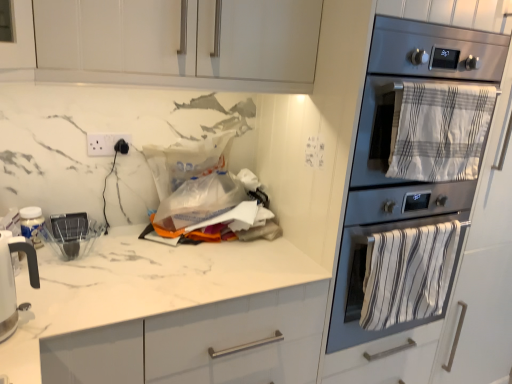
This screenshot has height=384, width=512. What do you see at coordinates (13, 280) in the screenshot?
I see `white glossy electric kettle at left` at bounding box center [13, 280].

Describe the element at coordinates (408, 274) in the screenshot. The image size is (512, 384). I see `white striped towel at right, placed as the first blanket when sorted from bottom to top` at that location.

Locate an element on the screen. white marble countertop at center is located at coordinates (169, 314).

Measure the distance from white striped towel at right, which appears as the second blanket when viewed from the top, to white glossy electric kettle at left.

The distance of white striped towel at right, which appears as the second blanket when viewed from the top, from white glossy electric kettle at left is 1.13 meters.

Consider the image. What's the angular difference between white striped towel at right, placed as the first blanket when sorted from bottom to top, and white glossy electric kettle at left's facing directions?

The angle between the facing direction of white striped towel at right, placed as the first blanket when sorted from bottom to top, and the facing direction of white glossy electric kettle at left is 43.8 degrees.

Is white striped towel at right, which appears as the second blanket when viewed from the top, looking in the opposite direction of white glossy electric kettle at left?

No, white glossy electric kettle at left is not at the back of white striped towel at right, which appears as the second blanket when viewed from the top.

Considering the relative positions of white striped towel at right, placed as the first blanket when sorted from bottom to top, and white glossy electric kettle at left in the image provided, is white striped towel at right, placed as the first blanket when sorted from bottom to top, to the left of white glossy electric kettle at left from the viewer's perspective?

In fact, white striped towel at right, placed as the first blanket when sorted from bottom to top, is to the right of white glossy electric kettle at left.

Does white glossy electric kettle at left turn towards white marble countertop at center?

No, white glossy electric kettle at left is not aimed at white marble countertop at center.

From the picture: Who is shorter, white glossy electric kettle at left or white marble countertop at center?

white glossy electric kettle at left is shorter.

From the picture: Considering the relative sizes of white glossy electric kettle at left and white marble countertop at center in the image provided, is white glossy electric kettle at left smaller than white marble countertop at center?

Yes.

Is white glossy electric kettle at left closer to the viewer compared to white marble countertop at center?

Yes.

Considering the positions of objects white plastic electric outlet at upper left and white glossy cabinet at upper center in the image provided, who is more to the left, white plastic electric outlet at upper left or white glossy cabinet at upper center?

white plastic electric outlet at upper left.

From a real-world perspective, is white plastic electric outlet at upper left located beneath white glossy cabinet at upper center?

Yes.

Does white plastic electric outlet at upper left have a greater height compared to white glossy cabinet at upper center?

In fact, white plastic electric outlet at upper left may be shorter than white glossy cabinet at upper center.

Can you tell me how much white plastic electric outlet at upper left and white glossy cabinet at upper center differ in facing direction?

0.342 degrees separate the facing orientations of white plastic electric outlet at upper left and white glossy cabinet at upper center.

Which object is positioned more to the left, white striped towel at right, which is the 2th blanket from bottom to top, or white glossy cabinet at upper center?

white glossy cabinet at upper center.

Is white striped towel at right, which is the first blanket from top to bottom, smaller than white glossy cabinet at upper center?

Yes.

Which is in front, point (435, 120) or point (23, 14)?

Positioned in front is point (23, 14).

From a real-world perspective, is white striped towel at right, placed as the first blanket when sorted from bottom to top, positioned above or below white striped towel at right, which is the first blanket from top to bottom?

In terms of real-world spatial position, white striped towel at right, placed as the first blanket when sorted from bottom to top, is below white striped towel at right, which is the first blanket from top to bottom.

How far apart are white striped towel at right, placed as the first blanket when sorted from bottom to top, and white striped towel at right, which is the 2th blanket from bottom to top?

The distance of white striped towel at right, placed as the first blanket when sorted from bottom to top, from white striped towel at right, which is the 2th blanket from bottom to top, is 13.84 inches.

Considering the points (387, 237) and (439, 106), which point is in front, point (387, 237) or point (439, 106)?

The point (439, 106) is closer.

Looking at this image, which is more to the left, white striped towel at right, placed as the first blanket when sorted from bottom to top, or white striped towel at right, which is the 2th blanket from bottom to top?

white striped towel at right, placed as the first blanket when sorted from bottom to top.

Which object is positioned more to the right, stainless steel oven at right or white striped towel at right, which is the 2th blanket from bottom to top?

white striped towel at right, which is the 2th blanket from bottom to top.

Considering the relative sizes of stainless steel oven at right and white striped towel at right, which is the first blanket from top to bottom, in the image provided, is stainless steel oven at right smaller than white striped towel at right, which is the first blanket from top to bottom,?

No, stainless steel oven at right is not smaller than white striped towel at right, which is the first blanket from top to bottom.

From the image's perspective, between stainless steel oven at right and white striped towel at right, which is the 2th blanket from bottom to top, which one is located above?

white striped towel at right, which is the 2th blanket from bottom to top.

Considering the sizes of objects stainless steel oven at right and white striped towel at right, which is the first blanket from top to bottom, in the image provided, who is shorter, stainless steel oven at right or white striped towel at right, which is the first blanket from top to bottom,?

Standing shorter between the two is white striped towel at right, which is the first blanket from top to bottom.

Is white striped towel at right, which appears as the second blanket when viewed from the top, completely or partially outside of white plastic electric outlet at upper left?

Yes, white striped towel at right, which appears as the second blanket when viewed from the top, is located beyond the bounds of white plastic electric outlet at upper left.

Based on their positions, is white striped towel at right, placed as the first blanket when sorted from bottom to top, located to the left or right of white plastic electric outlet at upper left?

Based on their positions, white striped towel at right, placed as the first blanket when sorted from bottom to top, is located to the right of white plastic electric outlet at upper left.

Measure the distance from white striped towel at right, placed as the first blanket when sorted from bottom to top, to white plastic electric outlet at upper left.

white striped towel at right, placed as the first blanket when sorted from bottom to top, and white plastic electric outlet at upper left are 3.61 feet apart.

Locate an element on the screen. The width and height of the screenshot is (512, 384). electric outlet that appears behind the white striped towel at right, which appears as the second blanket when viewed from the top is located at coordinates (104, 143).

What are the coordinates of `blanket that is below the white glossy electric kettle at left (from the image's perspective)` in the screenshot? It's located at (408, 274).

The height and width of the screenshot is (384, 512). In order to click on countertop on the right of white glossy electric kettle at left in this screenshot , I will do `click(169, 314)`.

Based on the photo, considering their positions, is white striped towel at right, which is the 2th blanket from bottom to top, positioned further to white glossy cabinet at upper center than white glossy electric kettle at left?

white glossy electric kettle at left.

Estimate the real-world distances between objects in this image. Which object is further from white glossy cabinet at upper center, stainless steel oven at right or white glossy electric kettle at left?

white glossy electric kettle at left lies further to white glossy cabinet at upper center than the other object.

Considering their positions, is white striped towel at right, placed as the first blanket when sorted from bottom to top, positioned closer to stainless steel oven at right than white marble countertop at center?

Among the two, white striped towel at right, placed as the first blanket when sorted from bottom to top, is located nearer to stainless steel oven at right.

When comparing their distances from white glossy cabinet at upper center, does white striped towel at right, which is the first blanket from top to bottom, or white marble countertop at center seem closer?

Among the two, white striped towel at right, which is the first blanket from top to bottom, is located nearer to white glossy cabinet at upper center.

Looking at the image, which one is located closer to white glossy electric kettle at left, white plastic electric outlet at upper left or white striped towel at right, which is the 2th blanket from bottom to top?

The object closer to white glossy electric kettle at left is white plastic electric outlet at upper left.

Considering their positions, is white striped towel at right, which is the first blanket from top to bottom, positioned closer to white marble countertop at center than white glossy electric kettle at left?

white glossy electric kettle at left lies closer to white marble countertop at center than the other object.

From the image, which object appears to be nearer to white glossy cabinet at upper center, white marble countertop at center or white glossy electric kettle at left?

white glossy electric kettle at left.

Estimate the real-world distances between objects in this image. Which object is further from white striped towel at right, which appears as the second blanket when viewed from the top, white glossy electric kettle at left or white marble countertop at center?

white glossy electric kettle at left is further to white striped towel at right, which appears as the second blanket when viewed from the top.

You are a GUI agent. You are given a task and a screenshot of the screen. Output one action in this format:
    pyautogui.click(x=<x>, y=<y>)
    Task: Click on the kitchen appliance between white marble countertop at center and white striped towel at right, placed as the first blanket when sorted from bottom to top, in the horizontal direction
    
    Given the screenshot: What is the action you would take?
    pyautogui.click(x=388, y=153)

Where is `electric outlet between white glossy cabinet at upper center and white glossy electric kettle at left from top to bottom`? electric outlet between white glossy cabinet at upper center and white glossy electric kettle at left from top to bottom is located at coordinates (104, 143).

Locate an element on the screen. The height and width of the screenshot is (384, 512). countertop between white glossy electric kettle at left and white striped towel at right, which is the 2th blanket from bottom to top, from left to right is located at coordinates (169, 314).

Image resolution: width=512 pixels, height=384 pixels. Find the location of `kitchen appliance between white striped towel at right, which is the 2th blanket from bottom to top, and white striped towel at right, which appears as the second blanket when viewed from the top, in the up-down direction`. kitchen appliance between white striped towel at right, which is the 2th blanket from bottom to top, and white striped towel at right, which appears as the second blanket when viewed from the top, in the up-down direction is located at coordinates (388, 153).